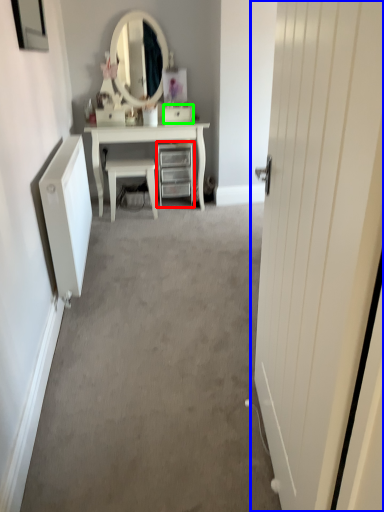
Question: Considering the real-world distances, which object is closest to chest of drawers (highlighted by a red box)? door (highlighted by a blue box) or drawer (highlighted by a green box).

Choices:
 (A) door
 (B) drawer

Answer: (B)